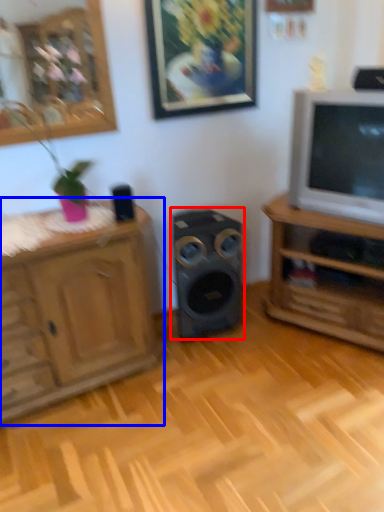
Question: Which of the following is the closest to the observer, speaker (highlighted by a red box) or cabinetry (highlighted by a blue box)?

Choices:
 (A) speaker
 (B) cabinetry

Answer: (B)